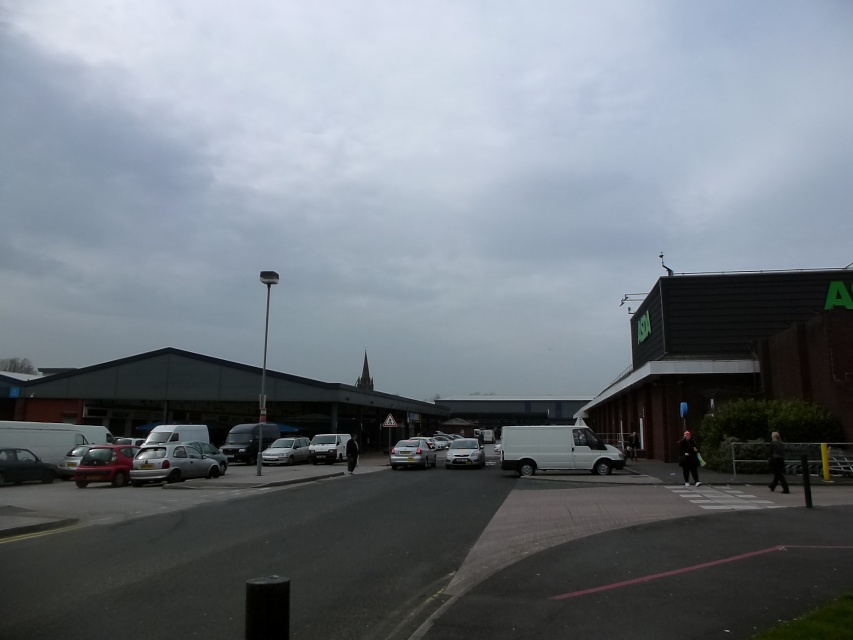
You are a delivery driver who needs to park your vehicle in the parking area. You see a silver metallic hatchback at center and a silver metallic car at center. Which one is positioned to the right side of the other?

The silver metallic hatchback at center is to the right of the silver metallic car at center.

You are standing at the entrance of the supermarket and want to locate two points marked in the parking area. The first point is at coordinates point (154, 458) and the second is at point (286, 456). Which point is closer to your current position?

Point (154, 458) is closer to the camera than point (286, 456), so the first point is closer to your current position.

You are a delivery driver who needs to park your vehicle in this parking area. Your truck is 1.8 meters wide. The parking spot you want to use is currently occupied by two vehicles. The silver metallic hatchback at center and the satin silver sedan at center. Can you determine if your truck will fit in the parking spot if you remove both vehicles?

The silver metallic hatchback at center is wider than the satin silver sedan at center. Since the parking spot is occupied by both vehicles, the total width available after removing them would depend on their combined width. However, without knowing the exact widths of both vehicles, it is impossible to determine if the 1.8 meter wide truck will fit.